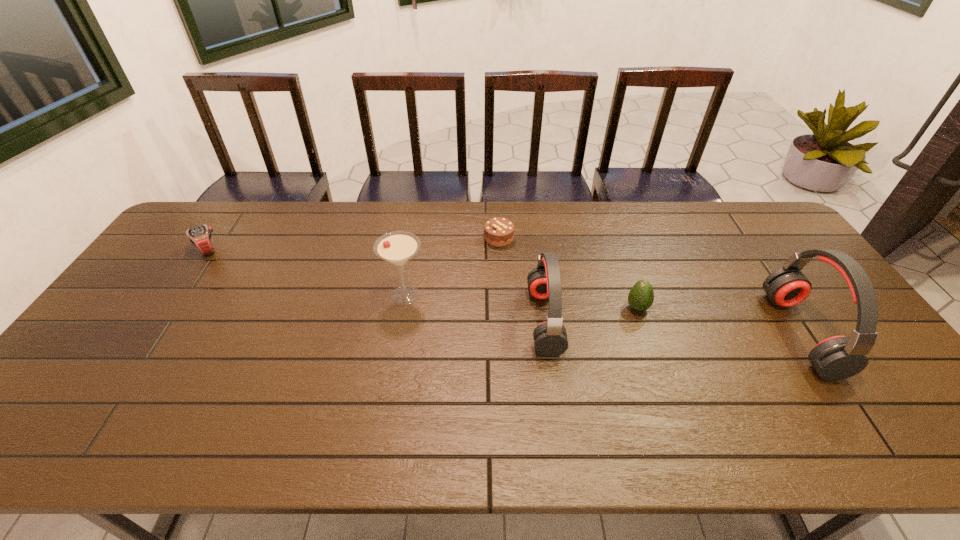
Identify the location of free space for a new earphone on the left. (302, 308).